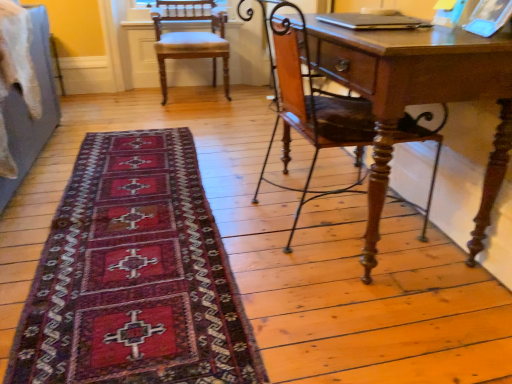
The image size is (512, 384). Find the location of `free space in front of wooden chair at right, which ranks as the 1th chair in right-to-left order`. free space in front of wooden chair at right, which ranks as the 1th chair in right-to-left order is located at coordinates (364, 312).